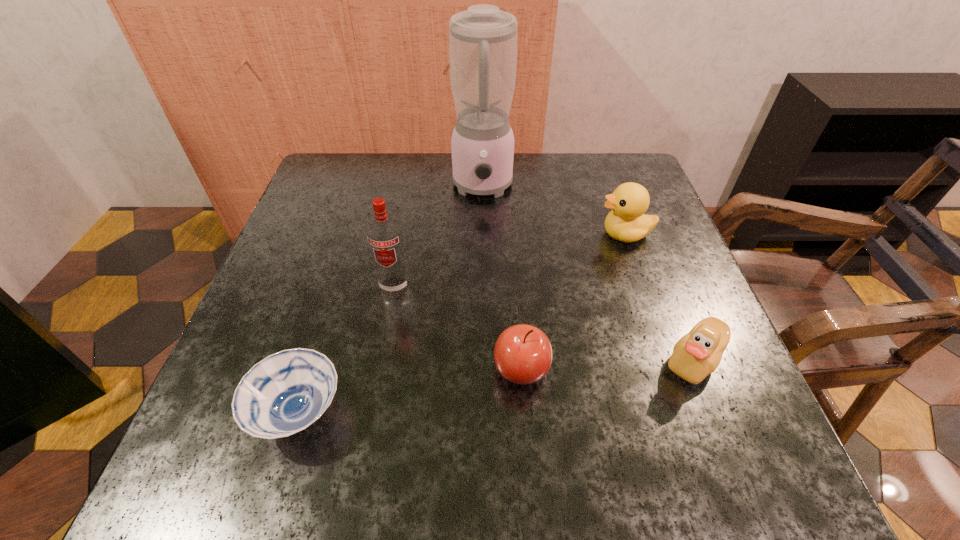
The width and height of the screenshot is (960, 540). What are the coordinates of `free space between the shortest object and the apple` in the screenshot? It's located at (410, 390).

Locate which object ranks fifth in proximity to the apple. Please provide its 2D coordinates. Your answer should be formatted as a tuple, i.e. [(x, y)], where the tuple contains the x and y coordinates of a point satisfying the conditions above.

[(483, 39)]

You are a GUI agent. You are given a task and a screenshot of the screen. Output one action in this format:
    pyautogui.click(x=<x>, y=<y>)
    Task: Click on the fifth closest object to the farthest object
    This screenshot has height=540, width=960.
    Given the screenshot: What is the action you would take?
    pyautogui.click(x=285, y=393)

Find the location of a particular element. Image resolution: width=960 pixels, height=540 pixels. free location that satisfies the following two spatial constraints: 1. on the base of the apple near the control knob; 2. on the right side of the farthest object is located at coordinates (484, 369).

The image size is (960, 540). What are the coordinates of `free point that satisfies the following two spatial constraints: 1. on the base of the tallest object near the control knob; 2. on the right side of the apple` in the screenshot? It's located at (484, 369).